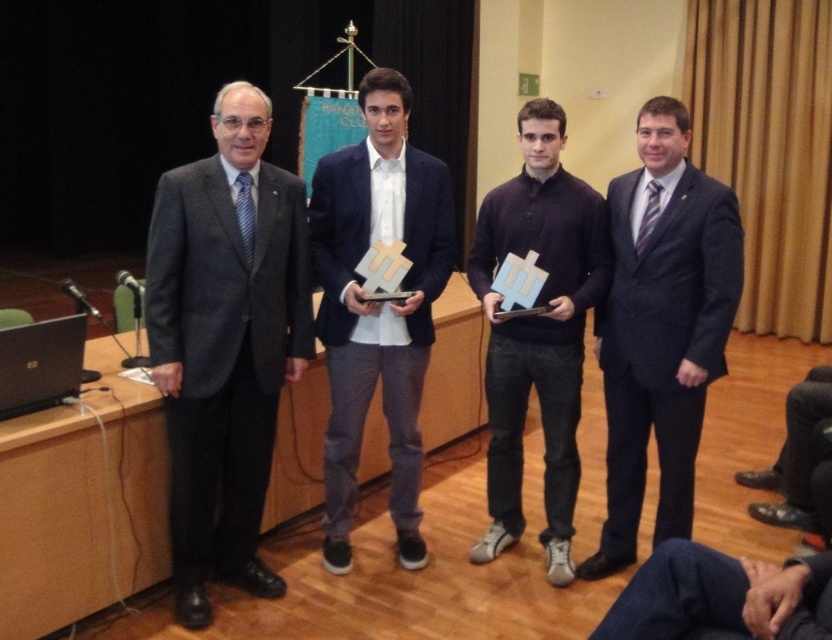
Which is below, gray wool suit at left or dark blue sweater at center?

gray wool suit at left

Is point (187, 582) farther from viewer compared to point (520, 388)?

No, (187, 582) is in front of (520, 388).

In order to click on gray wool suit at left in this screenshot , I will do `click(225, 342)`.

Who is positioned more to the left, gray wool suit at left or dark blue suit at center?

gray wool suit at left is more to the left.

Can you confirm if gray wool suit at left is positioned below dark blue suit at center?

Incorrect, gray wool suit at left is not positioned below dark blue suit at center.

Where is `gray wool suit at left`? The height and width of the screenshot is (640, 832). gray wool suit at left is located at coordinates (225, 342).

Can you confirm if navy blue suit at center is positioned to the right of dark blue sweater at center?

No, navy blue suit at center is not to the right of dark blue sweater at center.

This screenshot has height=640, width=832. What do you see at coordinates (377, 305) in the screenshot? I see `navy blue suit at center` at bounding box center [377, 305].

You are a GUI agent. You are given a task and a screenshot of the screen. Output one action in this format:
    pyautogui.click(x=<x>, y=<y>)
    Task: Click on the navy blue suit at center
    
    Given the screenshot: What is the action you would take?
    pyautogui.click(x=377, y=305)